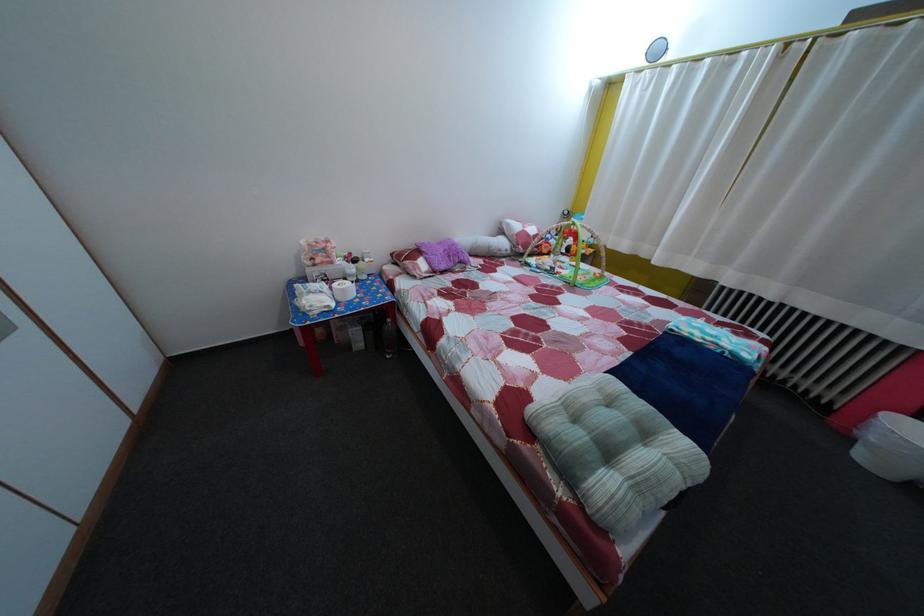
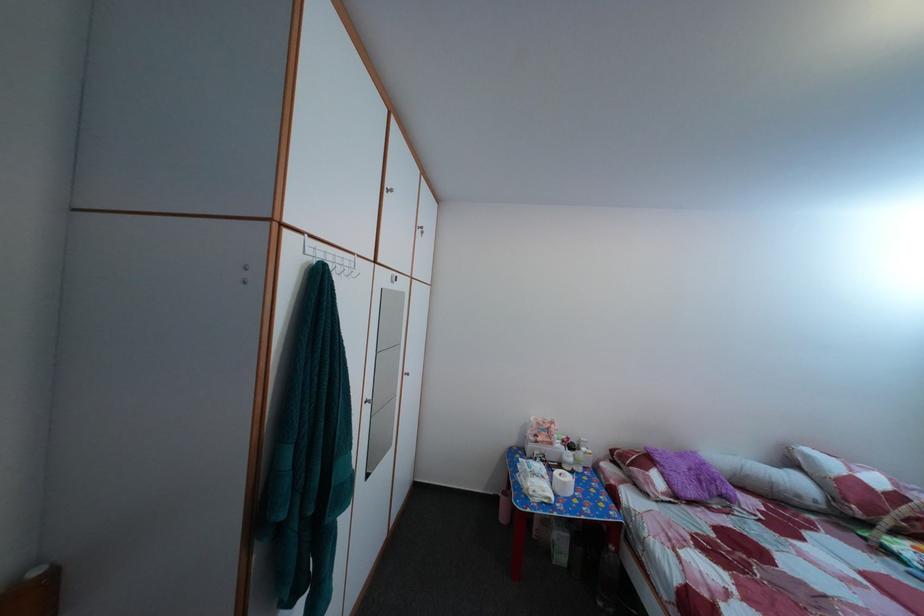
In the second image, find the point that corresponds to point 337,286 in the first image.

(555, 469)